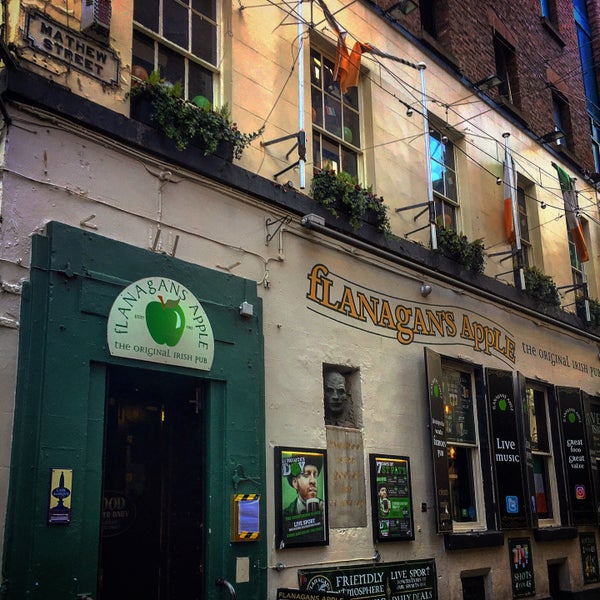
Where is `picture`? Image resolution: width=600 pixels, height=600 pixels. picture is located at coordinates (307, 504), (396, 515).